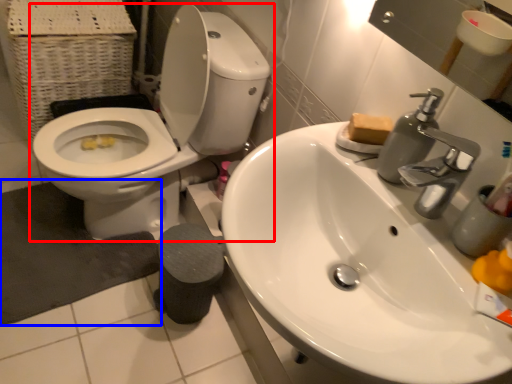
Question: Which point is further to the camera, toilet (highlighted by a red box) or bath mat (highlighted by a blue box)?

Choices:
 (A) toilet
 (B) bath mat

Answer: (B)